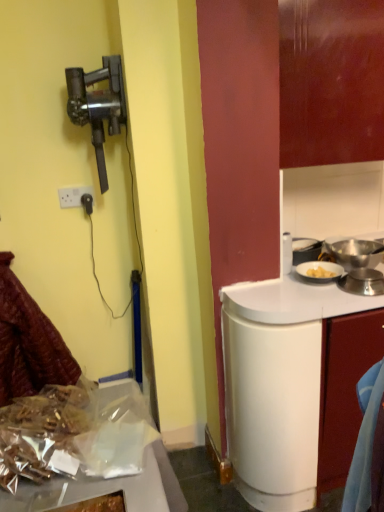
Question: From a real-world perspective, is white glossy cabinet at right positioned above or below white plastic power outlet at upper left?

Choices:
 (A) below
 (B) above

Answer: (A)

Question: In the image, is white glossy cabinet at right on the left side or the right side of white plastic power outlet at upper left?

Choices:
 (A) left
 (B) right

Answer: (B)

Question: Which of these objects is positioned closest to the white plastic power outlet at upper left?

Choices:
 (A) shiny metallic foil at lower left
 (B) leather-like maroon coat at lower left
 (C) metallic black vacuum cleaner at left
 (D) white glossy cabinet at right

Answer: (C)

Question: Which of these objects is positioned closest to the white glossy cabinet at right?

Choices:
 (A) metallic black vacuum cleaner at left
 (B) shiny metallic foil at lower left
 (C) leather-like maroon coat at lower left
 (D) white plastic power outlet at upper left

Answer: (B)